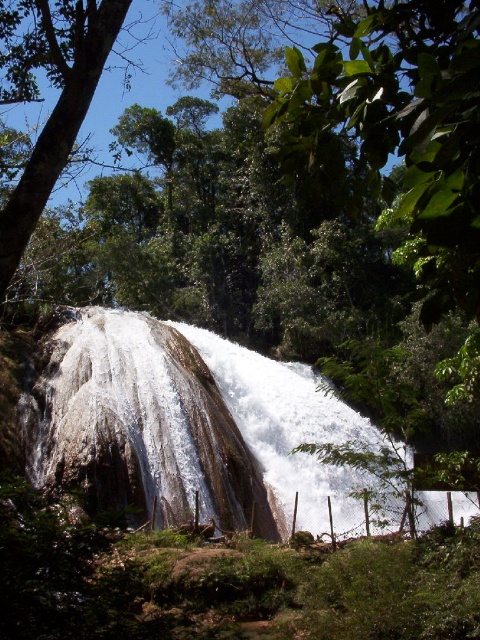
Which is more to the left, white smooth waterfall at center or green leafy tree at upper left?

Positioned to the left is green leafy tree at upper left.

Between point (346, 499) and point (79, 13), which one is positioned behind?

The point (346, 499) is behind.

The width and height of the screenshot is (480, 640). What do you see at coordinates (187, 422) in the screenshot?
I see `white smooth waterfall at center` at bounding box center [187, 422].

This screenshot has height=640, width=480. What are the coordinates of `white smooth waterfall at center` in the screenshot? It's located at (187, 422).